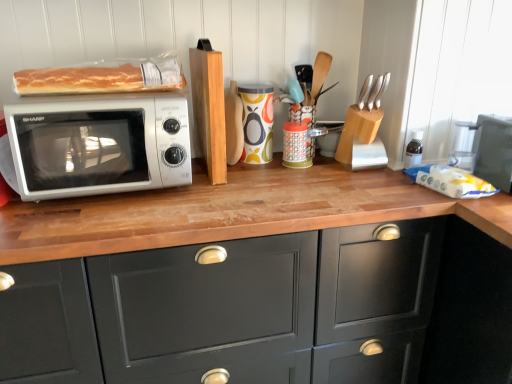
Question: From a real-world perspective, is matte black toaster oven at right, acting as the 1th appliance starting from the right, positioned under matte black cabinet at center based on gravity?

Choices:
 (A) no
 (B) yes

Answer: (A)

Question: Can you confirm if matte black toaster oven at right, acting as the 1th appliance starting from the right, is smaller than matte black cabinet at center?

Choices:
 (A) yes
 (B) no

Answer: (A)

Question: Is matte black toaster oven at right, acting as the 1th appliance starting from the right, positioned beyond the bounds of matte black cabinet at center?

Choices:
 (A) yes
 (B) no

Answer: (A)

Question: Is matte black toaster oven at right, acting as the 1th appliance starting from the right, behind matte black cabinet at center?

Choices:
 (A) yes
 (B) no

Answer: (A)

Question: Can you confirm if matte black toaster oven at right, acting as the 1th appliance starting from the right, is taller than matte black cabinet at center?

Choices:
 (A) no
 (B) yes

Answer: (A)

Question: From the image's perspective, relative to wooden knife block at center, which is counted as the 2th appliance, starting from the left, is wooden knife block at upper right, placed as the third appliance when sorted from left to right, above or below?

Choices:
 (A) above
 (B) below

Answer: (A)

Question: Visually, is wooden knife block at upper right, placed as the third appliance when sorted from left to right, positioned to the left or to the right of wooden knife block at center, arranged as the third appliance when viewed from the right?

Choices:
 (A) right
 (B) left

Answer: (A)

Question: Considering the positions of wooden knife block at upper right, placed as the third appliance when sorted from left to right, and wooden knife block at center, which is counted as the 2th appliance, starting from the left, in the image, is wooden knife block at upper right, placed as the third appliance when sorted from left to right, taller or shorter than wooden knife block at center, which is counted as the 2th appliance, starting from the left,?

Choices:
 (A) tall
 (B) short

Answer: (A)

Question: Does point (365, 92) appear closer or farther from the camera than point (332, 127)?

Choices:
 (A) closer
 (B) farther

Answer: (A)

Question: Based on their positions, is wooden knife block at center, which is counted as the 2th appliance, starting from the left, located to the left or right of silver metallic knife block at upper right?

Choices:
 (A) left
 (B) right

Answer: (A)

Question: Is wooden knife block at center, which is counted as the 2th appliance, starting from the left, situated inside silver metallic knife block at upper right or outside?

Choices:
 (A) outside
 (B) inside

Answer: (A)

Question: In terms of width, does wooden knife block at center, which is counted as the 2th appliance, starting from the left, look wider or thinner when compared to silver metallic knife block at upper right?

Choices:
 (A) wide
 (B) thin

Answer: (A)

Question: Considering their positions, is wooden knife block at center, which is counted as the 2th appliance, starting from the left, located in front of or behind silver metallic knife block at upper right?

Choices:
 (A) front
 (B) behind

Answer: (B)

Question: In terms of width, does wooden knife block at center, arranged as the third appliance when viewed from the right, look wider or thinner when compared to translucent plastic bread at upper left?

Choices:
 (A) thin
 (B) wide

Answer: (A)

Question: Do you think wooden knife block at center, arranged as the third appliance when viewed from the right, is within translucent plastic bread at upper left, or outside of it?

Choices:
 (A) inside
 (B) outside

Answer: (B)